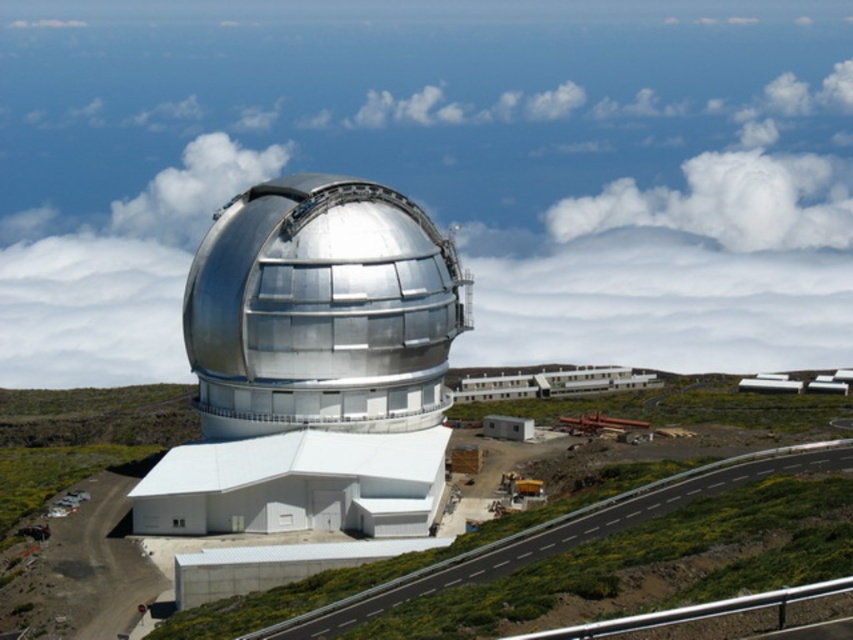
Question: Is metallic silver dome at center wider than white fluffy cloud at upper center?

Choices:
 (A) no
 (B) yes

Answer: (B)

Question: Does metallic silver dome at center appear under white fluffy cloud at upper center?

Choices:
 (A) no
 (B) yes

Answer: (B)

Question: Which object is positioned closest to the white fluffy cloud at upper center?

Choices:
 (A) metallic silver dome at center
 (B) polished silver observatory at center

Answer: (A)

Question: Which point is farther from the camera taking this photo?

Choices:
 (A) (717, 230)
 (B) (790, 97)

Answer: (B)

Question: Which point is farther from the camera taking this photo?

Choices:
 (A) (292, 465)
 (B) (587, 218)

Answer: (B)

Question: Can you confirm if polished silver observatory at center is positioned to the right of white fluffy cloud at upper center?

Choices:
 (A) no
 (B) yes

Answer: (A)